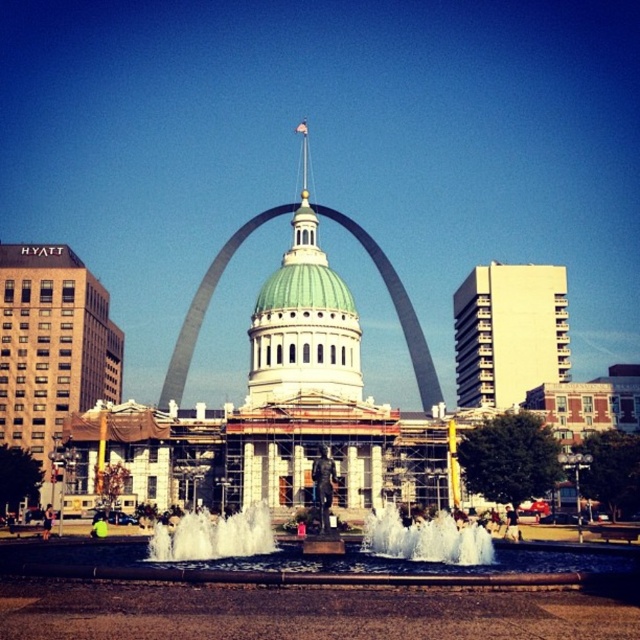
You are a tour guide leading a group to the Gateway Arch National Park. You want to take a photo of the green dome at center and the white frothy water at center from a distance where both can be captured clearly. What is the minimum distance you need to stand away from the closest object to ensure both are in frame?

The green dome at center and white frothy water at center are 25.88 meters apart. To capture both in the frame, you need to stand at least 25.88 meters away from the closest object.

You are a tourist standing in the square and want to take a photo of the green dome at center and the white frothy water at center. Which object should you focus on first to ensure both are in the frame?

You should focus on the green dome at center first because it is closer to you than the white frothy water at center. Since it is closer, adjusting the focus starting from the closer object ensures both will be in the frame.